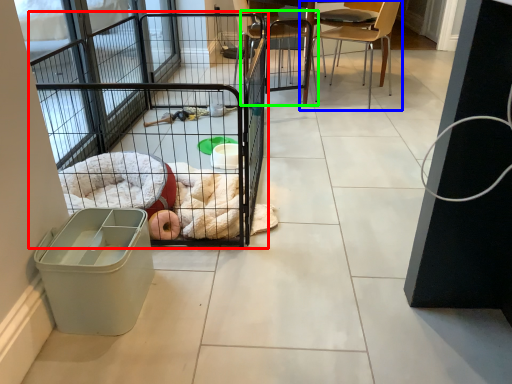
Question: Based on their relative distances, which object is farther from cage (highlighted by a red box)? Choose from chair (highlighted by a blue box) and chair (highlighted by a green box).

Choices:
 (A) chair
 (B) chair

Answer: (A)